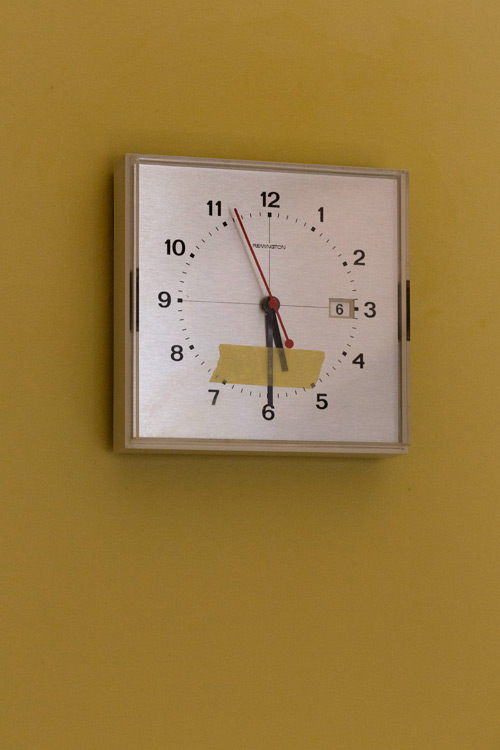
Locate an element on the screen. square clock is located at coordinates (349, 216).